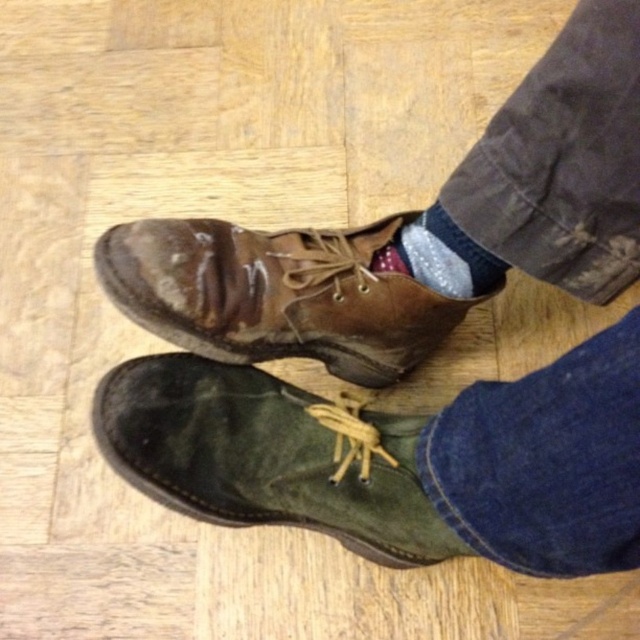
Does green suede boot at lower left appear on the left side of sparkly silver sock at center?

Correct, you'll find green suede boot at lower left to the left of sparkly silver sock at center.

Consider the image. Is green suede boot at lower left shorter than sparkly silver sock at center?

In fact, green suede boot at lower left may be taller than sparkly silver sock at center.

Find the location of `green suede boot at lower left`. green suede boot at lower left is located at coordinates (268, 456).

Locate an element on the screen. The image size is (640, 640). green suede boot at lower left is located at coordinates (268, 456).

Can you confirm if green suede boot at lower left is wider than brown suede boot at center?

In fact, green suede boot at lower left might be narrower than brown suede boot at center.

Between green suede boot at lower left and brown suede boot at center, which one appears on the left side from the viewer's perspective?

brown suede boot at center

Is point (205, 436) less distant than point (419, 301)?

Yes, point (205, 436) is in front of point (419, 301).

In order to click on green suede boot at lower left in this screenshot , I will do `click(268, 456)`.

Is point (449, 330) positioned in front of point (458, 273)?

No, it is behind (458, 273).

Between brown suede boot at center and sparkly silver sock at center, which one has less height?

sparkly silver sock at center is shorter.

This screenshot has height=640, width=640. I want to click on brown suede boot at center, so click(280, 294).